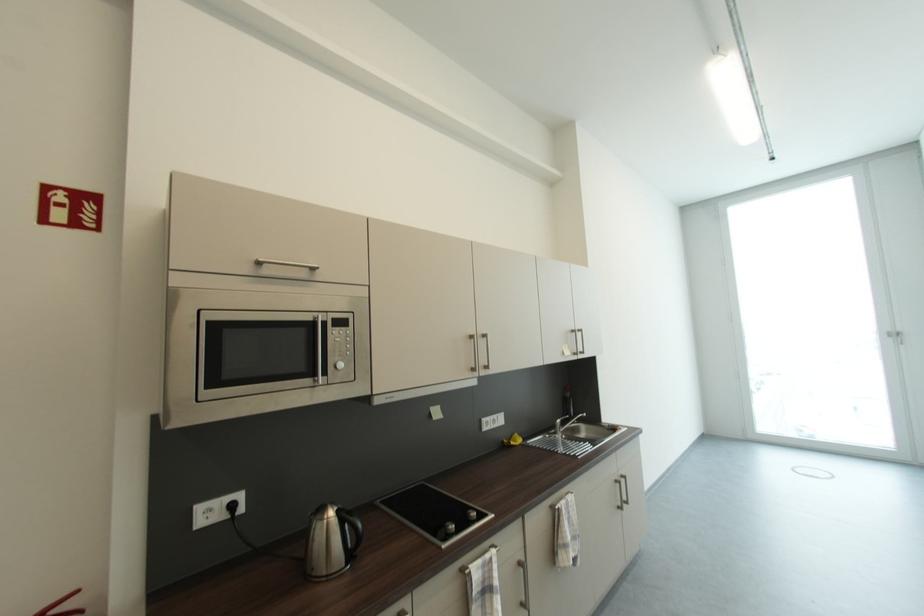
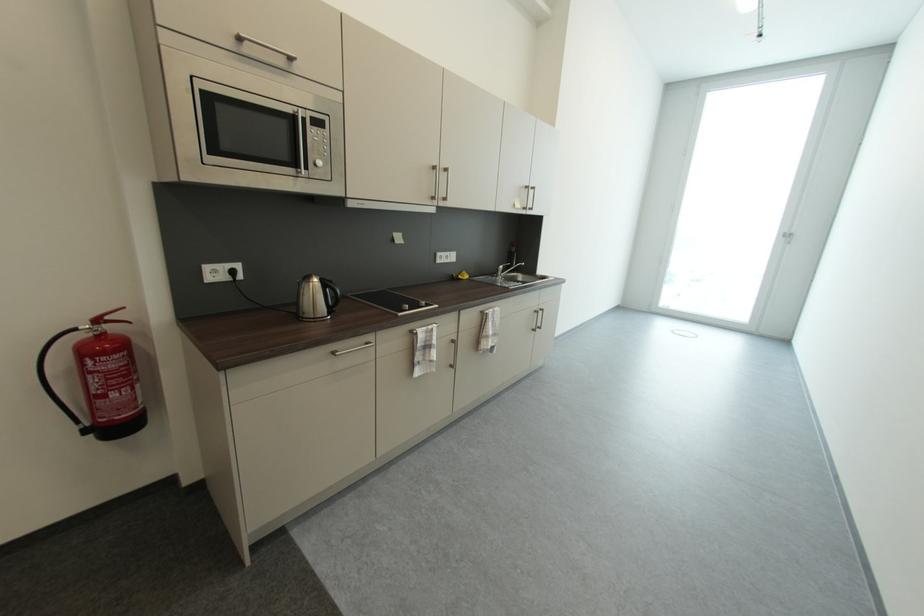
The point at [319,320] is marked in the first image. Where is the corresponding point in the second image?

(297, 113)